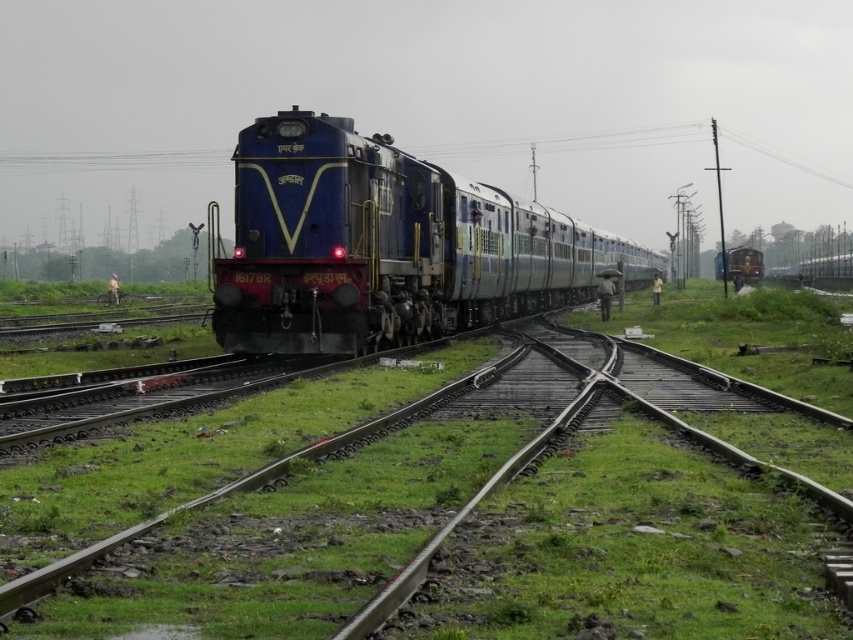
Question: Which point is farther to the camera?

Choices:
 (A) (407, 428)
 (B) (732, 273)
 (C) (422, 336)

Answer: (B)

Question: Which point is closer to the camera?

Choices:
 (A) polished brass steam engine at center
 (B) blue metallic train at center
 (C) smooth steel track at center

Answer: (C)

Question: Does smooth steel track at center come in front of blue metallic train at center?

Choices:
 (A) no
 (B) yes

Answer: (B)

Question: Can you confirm if blue metallic train at center is positioned to the left of polished brass steam engine at center?

Choices:
 (A) no
 (B) yes

Answer: (B)

Question: Which point is closer to the camera?

Choices:
 (A) [x=328, y=632]
 (B) [x=746, y=276]
 (C) [x=277, y=288]

Answer: (A)

Question: Can you confirm if smooth steel track at center is positioned above blue metallic train at center?

Choices:
 (A) no
 (B) yes

Answer: (A)